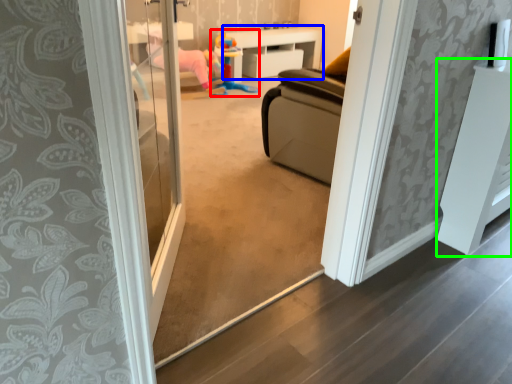
Question: Which object is positioned farthest from toy (highlighted by a red box)? Select from furniture (highlighted by a blue box) and furniture (highlighted by a green box).

Choices:
 (A) furniture
 (B) furniture

Answer: (B)